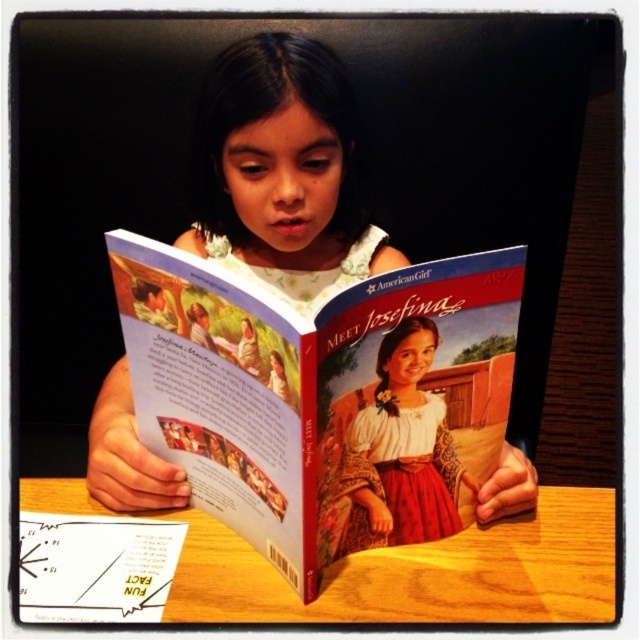
Question: Can you confirm if matte paper book at center is positioned to the right of white floral dress at center?

Choices:
 (A) no
 (B) yes

Answer: (B)

Question: Among these points, which one is nearest to the camera?

Choices:
 (A) (36, 509)
 (B) (216, 173)

Answer: (A)

Question: Does matte paper book at center lie behind white floral dress at center?

Choices:
 (A) no
 (B) yes

Answer: (A)

Question: Which point is closer to the camera?

Choices:
 (A) wooden table at center
 (B) matte paper book at center
 (C) white floral dress at center

Answer: (B)

Question: Which object appears farthest from the camera in this image?

Choices:
 (A) matte paper book at center
 (B) white floral dress at center
 (C) wooden table at center

Answer: (B)

Question: Can you confirm if white floral dress at center is positioned to the left of wooden table at center?

Choices:
 (A) no
 (B) yes

Answer: (B)